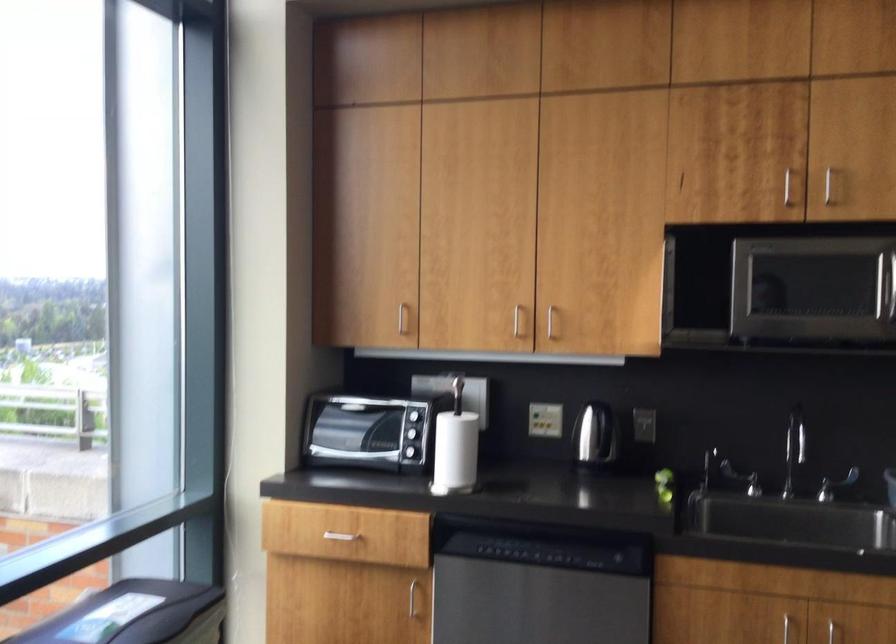
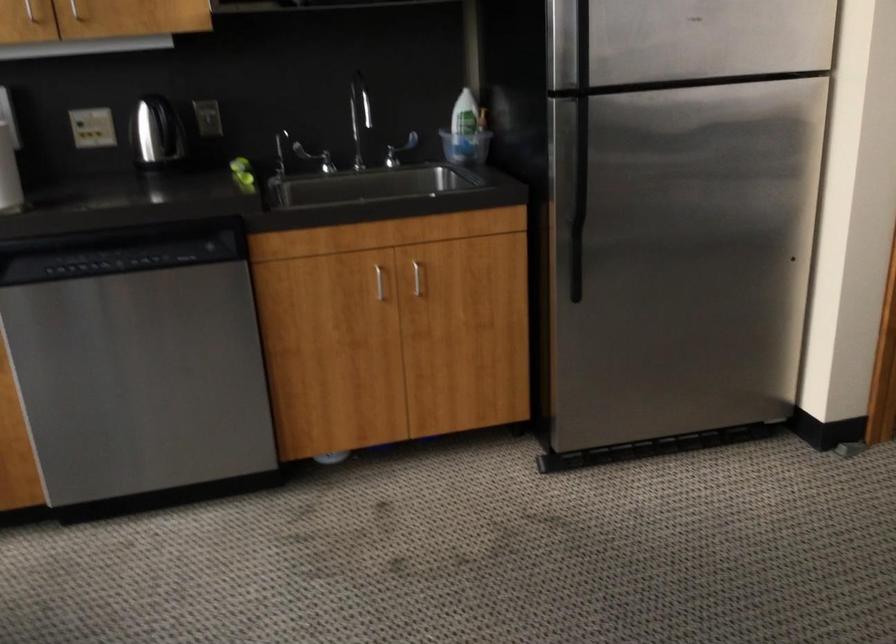
How did the camera likely rotate?

The camera's rotation is toward right-down.